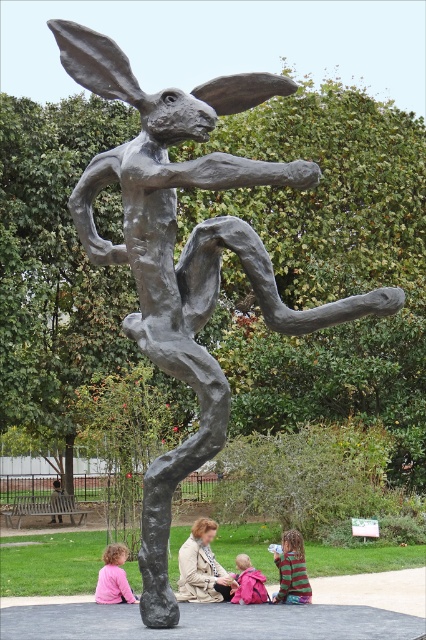
Based on the photo, what are the coordinates of the light brown leather jacket at center?

The light brown leather jacket at center is located at coordinates point (201, 566).

You are a photographer trying to capture the sculpture and the people in the foreground. You want to ensure that both the light brown leather jacket at center and the pink fabric at lower left are visible in your shot. Given their sizes, which object should you focus on to frame the composition properly?

The light brown leather jacket at center is larger in size than the pink fabric at lower left, so focusing on the light brown leather jacket at center will help frame the composition properly while ensuring both elements are visible.

You are a photographer trying to capture a group photo of the light brown leather jacket at center and the pink fabric at lower left. Since you want both subjects to appear equally sized in the photo, which subject should you move closer to the camera?

The pink fabric at lower left should be moved closer to the camera because its width is smaller than the light brown leather jacket at center, so bringing it nearer would balance their sizes in the photo.